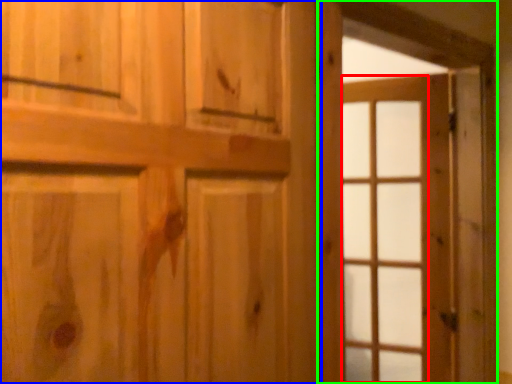
Question: Considering the real-world distances, which object is farthest from glass door (highlighted by a red box)? door (highlighted by a blue box) or barn door (highlighted by a green box)?

Choices:
 (A) door
 (B) barn door

Answer: (A)